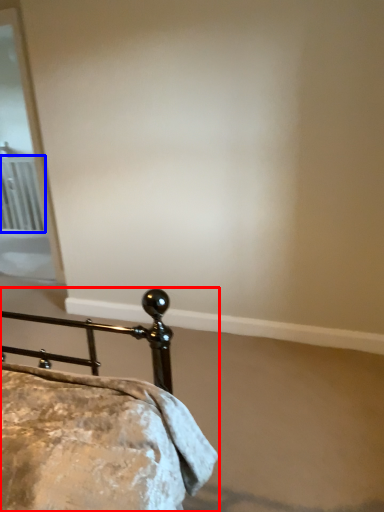
Question: Which object appears closest to the camera in this image, bed (highlighted by a red box) or radiator (highlighted by a blue box)?

Choices:
 (A) bed
 (B) radiator

Answer: (A)